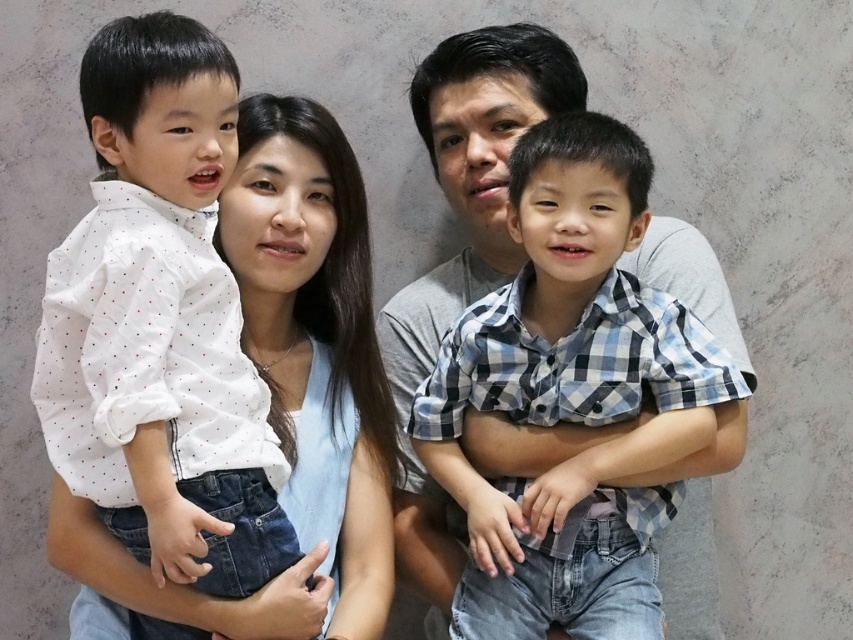
You are a photographer trying to capture a closeup of the checkered fabric shirt at center and the matte white shirt at left. Given that your camera can only focus on objects within a 10 inch range, will both shirts be in focus?

The checkered fabric shirt at center is 11.29 inches from the matte white shirt at left, which exceeds the camera focus range of 10 inches. Therefore, both shirts cannot be in focus simultaneously.

You are trying to decide which shirt to wear for a casual day out. The checkered fabric shirt at center and the matte white shirt at left are both options. Based on their sizes, which one would be more comfortable for layering under a jacket?

The checkered fabric shirt at center has a smaller width than the matte white shirt at left, so it might be more comfortable for layering under a jacket since it allows more room for movement.

Looking at the family photo, which object is smaller in size between the checkered fabric shirt at center and the matte white shirt at left?

The checkered fabric shirt at center is smaller in size compared to the matte white shirt at left.